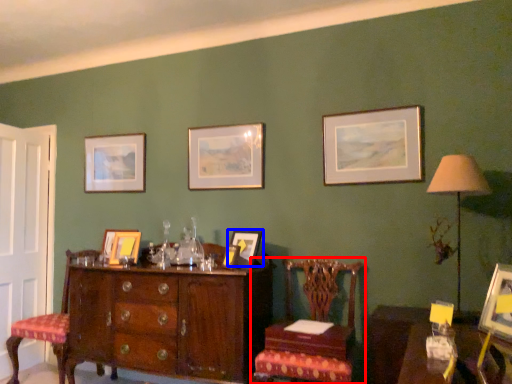
Question: Which object appears closest to the camera in this image, chair (highlighted by a red box) or picture frame (highlighted by a blue box)?

Choices:
 (A) chair
 (B) picture frame

Answer: (A)